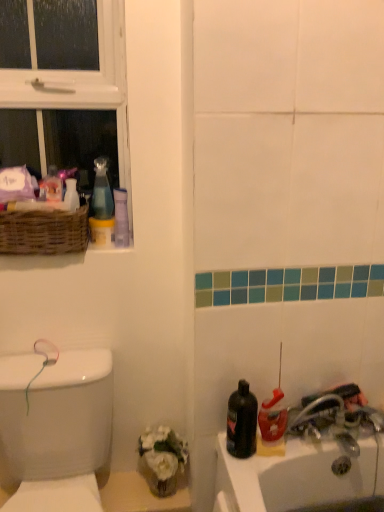
Question: Can you confirm if white plastic window at upper left is shorter than translucent plastic spray bottle at lower right, placed as the first cleaning product when sorted from right to left?

Choices:
 (A) no
 (B) yes

Answer: (A)

Question: From a real-world perspective, is white plastic window at upper left below translucent plastic spray bottle at lower right, which ranks as the second cleaning product in top-to-bottom order?

Choices:
 (A) no
 (B) yes

Answer: (A)

Question: Can you confirm if white plastic window at upper left is positioned to the left of translucent plastic spray bottle at lower right, placed as the first cleaning product when sorted from right to left?

Choices:
 (A) yes
 (B) no

Answer: (A)

Question: From a real-world perspective, does white plastic window at upper left stand above translucent plastic spray bottle at lower right, which is the first cleaning product from front to back?

Choices:
 (A) yes
 (B) no

Answer: (A)

Question: Is white plastic window at upper left not close to translucent plastic spray bottle at lower right, arranged as the second cleaning product when viewed from the back?

Choices:
 (A) yes
 (B) no

Answer: (B)

Question: From the image's perspective, relative to transparent plastic spray bottle at upper left, the first cleaning product viewed from the back, is translucent plastic spray bottle at lower right, which is the first cleaning product from front to back, above or below?

Choices:
 (A) above
 (B) below

Answer: (B)

Question: Looking at the image, does translucent plastic spray bottle at lower right, which ranks as the second cleaning product in top-to-bottom order, seem bigger or smaller compared to transparent plastic spray bottle at upper left, the first cleaning product in the top-to-bottom sequence?

Choices:
 (A) big
 (B) small

Answer: (B)

Question: Looking at their shapes, would you say translucent plastic spray bottle at lower right, placed as the first cleaning product when sorted from right to left, is wider or thinner than transparent plastic spray bottle at upper left, the first cleaning product viewed from the back?

Choices:
 (A) wide
 (B) thin

Answer: (B)

Question: Is point (264, 444) closer or farther from the camera than point (100, 164)?

Choices:
 (A) farther
 (B) closer

Answer: (B)

Question: From the image's perspective, is metallic silver faucet at lower right above or below white glossy porcelain at left?

Choices:
 (A) below
 (B) above

Answer: (B)

Question: In terms of width, does metallic silver faucet at lower right look wider or thinner when compared to white glossy porcelain at left?

Choices:
 (A) thin
 (B) wide

Answer: (A)

Question: Is metallic silver faucet at lower right taller or shorter than white glossy porcelain at left?

Choices:
 (A) tall
 (B) short

Answer: (B)

Question: Do you think metallic silver faucet at lower right is within white glossy porcelain at left, or outside of it?

Choices:
 (A) outside
 (B) inside

Answer: (A)

Question: From the image's perspective, is translucent plastic spray bottle at lower right, which is the first cleaning product from front to back, above or below woven brown basket at upper left?

Choices:
 (A) above
 (B) below

Answer: (B)

Question: In terms of size, does translucent plastic spray bottle at lower right, which is the first cleaning product from front to back, appear bigger or smaller than woven brown basket at upper left?

Choices:
 (A) small
 (B) big

Answer: (A)